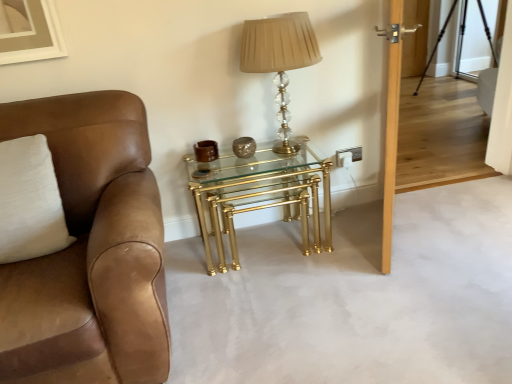
Question: Is white soft pillow at left wider than clear glass door at upper right, the 1th glass door when ordered from left to right?

Choices:
 (A) yes
 (B) no

Answer: (A)

Question: Is white soft pillow at left located outside clear glass door at upper right, the second glass door positioned from the right?

Choices:
 (A) yes
 (B) no

Answer: (A)

Question: From the image's perspective, would you say white soft pillow at left is positioned over clear glass door at upper right, the second glass door positioned from the right?

Choices:
 (A) no
 (B) yes

Answer: (A)

Question: Does white soft pillow at left turn towards clear glass door at upper right, the second glass door positioned from the right?

Choices:
 (A) yes
 (B) no

Answer: (B)

Question: Is the depth of white soft pillow at left greater than that of clear glass door at upper right, the 1th glass door when ordered from left to right?

Choices:
 (A) no
 (B) yes

Answer: (A)

Question: Considering the relative sizes of white soft pillow at left and clear glass door at upper right, the second glass door positioned from the right, in the image provided, is white soft pillow at left thinner than clear glass door at upper right, the second glass door positioned from the right,?

Choices:
 (A) yes
 (B) no

Answer: (B)

Question: Is white soft pillow at left located within transparent glass door at upper right, the second glass door viewed from the left?

Choices:
 (A) yes
 (B) no

Answer: (B)

Question: Is transparent glass door at upper right, which is counted as the first glass door, starting from the right, shorter than white soft pillow at left?

Choices:
 (A) yes
 (B) no

Answer: (B)

Question: Can you confirm if transparent glass door at upper right, which is counted as the first glass door, starting from the right, is smaller than white soft pillow at left?

Choices:
 (A) no
 (B) yes

Answer: (B)

Question: Considering the relative sizes of transparent glass door at upper right, the second glass door viewed from the left, and white soft pillow at left in the image provided, is transparent glass door at upper right, the second glass door viewed from the left, wider than white soft pillow at left?

Choices:
 (A) no
 (B) yes

Answer: (A)

Question: Would you say transparent glass door at upper right, the second glass door viewed from the left, is outside white soft pillow at left?

Choices:
 (A) no
 (B) yes

Answer: (B)

Question: From the image's perspective, would you say transparent glass door at upper right, which is counted as the first glass door, starting from the right, is positioned over white soft pillow at left?

Choices:
 (A) no
 (B) yes

Answer: (B)

Question: Is brown leather chair at left wider than transparent glass door at upper right, the second glass door viewed from the left?

Choices:
 (A) yes
 (B) no

Answer: (A)